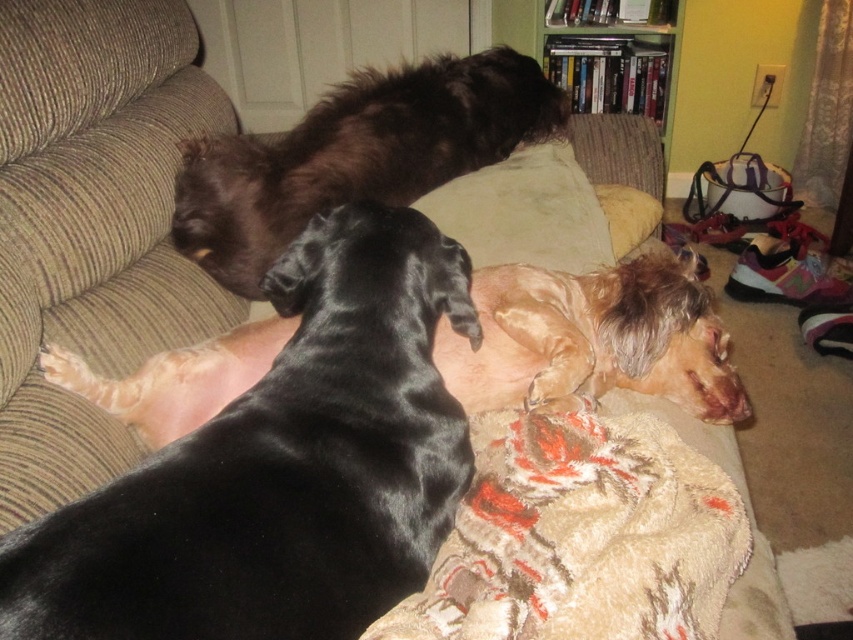
You are a dog owner who wants to place a new toy on the brown fabric couch at center. However, there is a beige knitted blanket at center already on it. Can you place the toy directly on the couch without moving the blanket?

The brown fabric couch at center is further to the viewer than the beige knitted blanket at center, which means the blanket is on top of the couch. Therefore, you can place the toy on the couch under the blanket, but not directly on the couch without moving the blanket.

Consider the image. You are a photographer setting up a shoot in the living room. You need to place a small tripod between the brown fabric couch at center and the beige fabric pillow at center. Based on their positions, which object should the tripod be placed closer to in order to ensure it is in the foreground of the photo?

The brown fabric couch at center is closer to the viewer than the beige fabric pillow at center, so the tripod should be placed closer to the brown fabric couch at center to ensure it is in the foreground.

You are a photographer trying to capture the shiny black dog at center without including the beige fabric pillow at center in the frame. Based on their positions, is this possible?

The shiny black dog at center is located below the beige fabric pillow at center, so it is possible to position the camera to capture the dog without including the pillow in the frame by angling the shot downward or moving the camera lower.